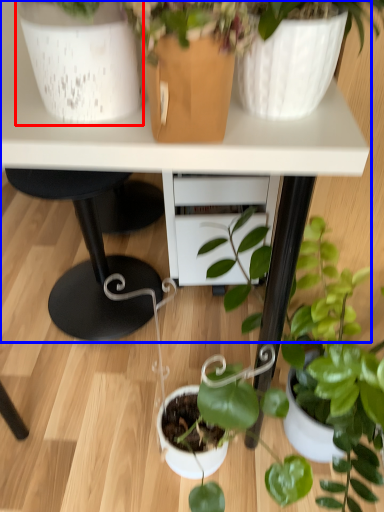
Question: Among these objects, which one is nearest to the camera, flowerpot (highlighted by a red box) or table (highlighted by a blue box)?

Choices:
 (A) flowerpot
 (B) table

Answer: (A)